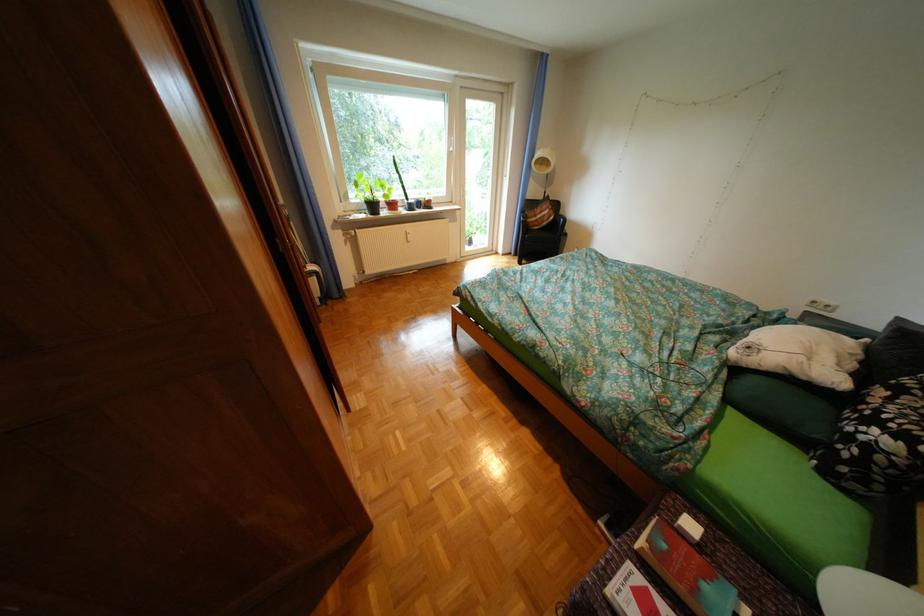
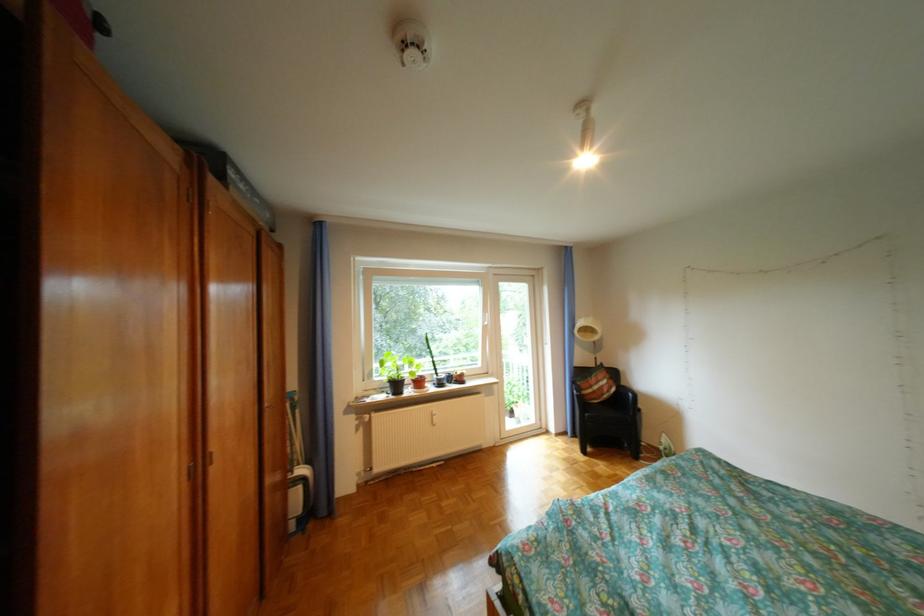
Question: Based on the continuous images, in which direction is the camera rotating? Reply with the corresponding letter.

Choices:
 (A) Left
 (B) Right
 (C) Up
 (D) Down

Answer: (C)